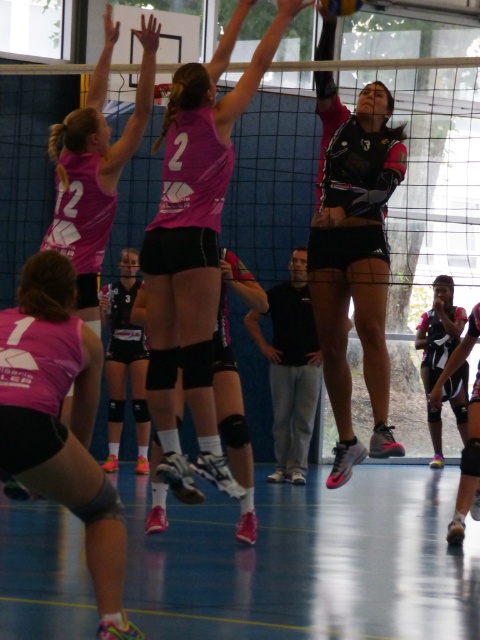
In the scene shown: You are a volleyball coach observing the game. You notice the pink matte volleyball net at center and the shiny black volleyball at upper center. Which object is wider?

The pink matte volleyball net at center is wider than the shiny black volleyball at upper center.

You are a spectator at the volleyball game and notice the pink matte volleyball net at center and the shiny black volleyball at upper center. Which object is positioned more to the right side of the court?

The shiny black volleyball at upper center is positioned more to the right side of the court because the pink matte volleyball net at center is to the left of it.

You are a spectator sitting at the back of the gymnasium watching the volleyball match. You notice two points marked on the court. Which point, point (227, 28) or point (92, 483), is closer to your position?

Point (227, 28) is further to the viewer than point (92, 483), so the point closer to your position is point (92, 483).